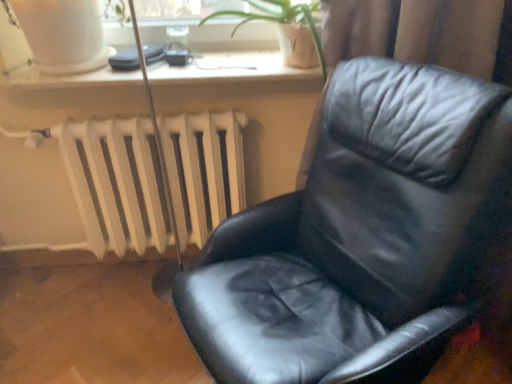
Question: From the image's perspective, is green leafy plant at upper center above white matte radiator at lower left?

Choices:
 (A) no
 (B) yes

Answer: (B)

Question: Does green leafy plant at upper center turn towards white matte radiator at lower left?

Choices:
 (A) yes
 (B) no

Answer: (B)

Question: Considering the relative sizes of green leafy plant at upper center and white matte radiator at lower left in the image provided, is green leafy plant at upper center wider than white matte radiator at lower left?

Choices:
 (A) no
 (B) yes

Answer: (B)

Question: From the image's perspective, is green leafy plant at upper center below white matte radiator at lower left?

Choices:
 (A) no
 (B) yes

Answer: (A)

Question: Could white matte radiator at lower left be considered to be inside green leafy plant at upper center?

Choices:
 (A) yes
 (B) no

Answer: (B)

Question: Is green leafy plant at upper center oriented away from white matte radiator at lower left?

Choices:
 (A) yes
 (B) no

Answer: (B)

Question: Is black leather chair at center aimed at white plastic window sill at upper center?

Choices:
 (A) no
 (B) yes

Answer: (A)

Question: Considering the relative sizes of black leather chair at center and white plastic window sill at upper center in the image provided, is black leather chair at center thinner than white plastic window sill at upper center?

Choices:
 (A) yes
 (B) no

Answer: (B)

Question: Does black leather chair at center have a greater height compared to white plastic window sill at upper center?

Choices:
 (A) no
 (B) yes

Answer: (B)

Question: Considering the relative positions of black leather chair at center and white plastic window sill at upper center in the image provided, is black leather chair at center to the right of white plastic window sill at upper center from the viewer's perspective?

Choices:
 (A) no
 (B) yes

Answer: (B)

Question: Considering the relative positions of black leather chair at center and white plastic window sill at upper center in the image provided, is black leather chair at center to the left of white plastic window sill at upper center from the viewer's perspective?

Choices:
 (A) yes
 (B) no

Answer: (B)

Question: From a real-world perspective, is black leather chair at center on white plastic window sill at upper center?

Choices:
 (A) yes
 (B) no

Answer: (B)

Question: Would you say black leather chair at center contains green leafy plant at upper center?

Choices:
 (A) yes
 (B) no

Answer: (B)